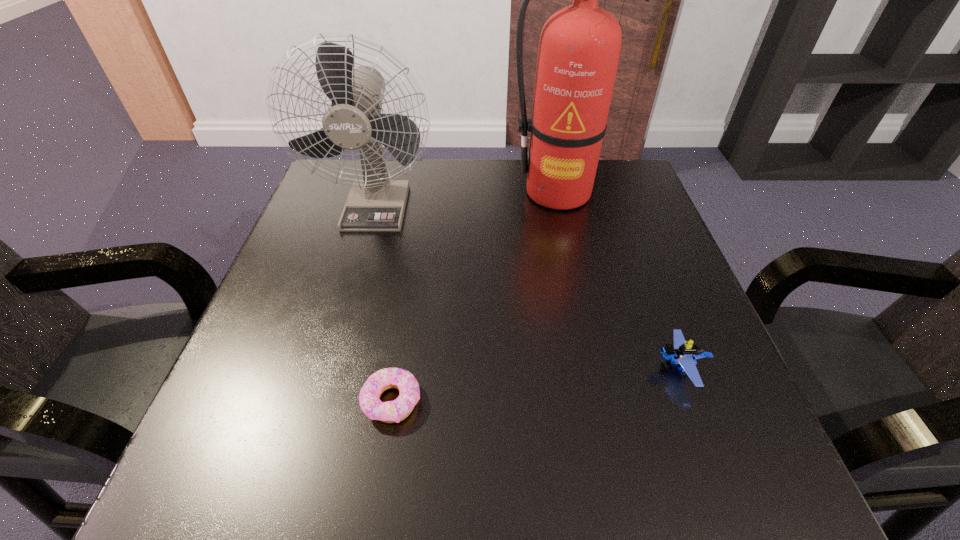
Image resolution: width=960 pixels, height=540 pixels. I want to click on blank region between the fire extinguisher and the fan, so click(x=467, y=199).

Identify the location of vacant region between the tallest object and the shortest object. The image size is (960, 540). (474, 296).

Find the location of a particular element. The image size is (960, 540). free space between the fire extinguisher and the second shortest object is located at coordinates (618, 280).

Where is `free spot between the fan and the tallest object`? This screenshot has height=540, width=960. free spot between the fan and the tallest object is located at coordinates (467, 199).

Identify which object is the third nearest to the tallest object. Please provide its 2D coordinates. Your answer should be formatted as a tuple, i.e. [(x, y)], where the tuple contains the x and y coordinates of a point satisfying the conditions above.

[(397, 410)]

At what (x,y) coordinates should I click in order to perform the action: click on object that is the closest to the fire extinguisher. Please return your answer as a coordinate pair (x, y). The height and width of the screenshot is (540, 960). Looking at the image, I should click on (354, 121).

Where is `vacant region that satisfies the following two spatial constraints: 1. on the air flow direction of the doughnut; 2. on the right side of the fan`? vacant region that satisfies the following two spatial constraints: 1. on the air flow direction of the doughnut; 2. on the right side of the fan is located at coordinates 323,401.

Image resolution: width=960 pixels, height=540 pixels. I want to click on free spot that satisfies the following two spatial constraints: 1. on the front-facing side of the Lego; 2. on the front side of the shortest object, so click(x=693, y=401).